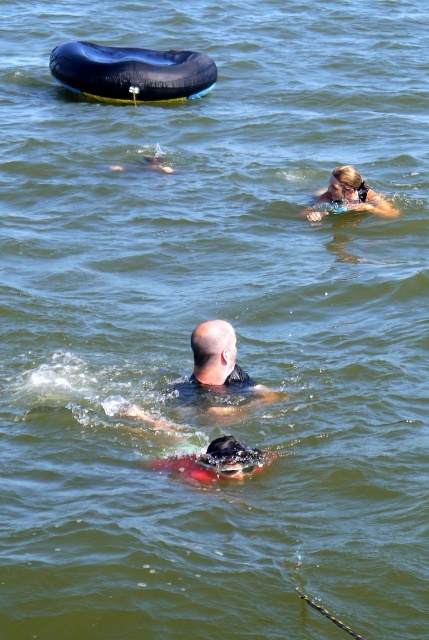
Question: Is dark gray rubber swim cap at center closer to camera compared to blonde hair swimmer at upper right?

Choices:
 (A) yes
 (B) no

Answer: (A)

Question: Estimate the real-world distances between objects in this image. Which object is farther from the dark gray rubber swim cap at center?

Choices:
 (A) blonde hair swimmer at upper right
 (B) bald head at center

Answer: (A)

Question: Which point is closer to the camera?

Choices:
 (A) (218, 346)
 (B) (218, 444)
 (C) (335, 186)

Answer: (B)

Question: Observing the image, what is the correct spatial positioning of dark gray rubber swim cap at center in reference to blonde hair swimmer at upper right?

Choices:
 (A) above
 (B) below

Answer: (B)

Question: Is dark gray rubber swim cap at center to the left of blonde hair swimmer at upper right from the viewer's perspective?

Choices:
 (A) no
 (B) yes

Answer: (B)

Question: Which object is the farthest from the dark gray rubber swim cap at center?

Choices:
 (A) bald head at center
 (B) blonde hair swimmer at upper right

Answer: (B)